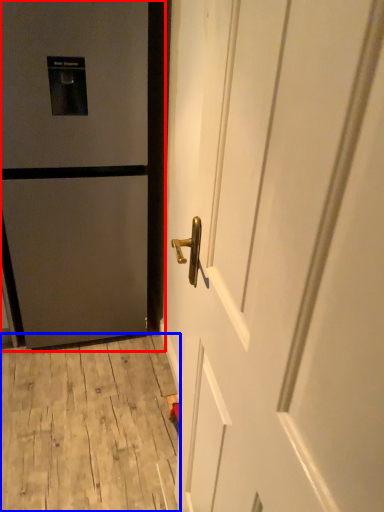
Question: Which point is further to the camera, door (highlighted by a red box) or plywood (highlighted by a blue box)?

Choices:
 (A) door
 (B) plywood

Answer: (B)